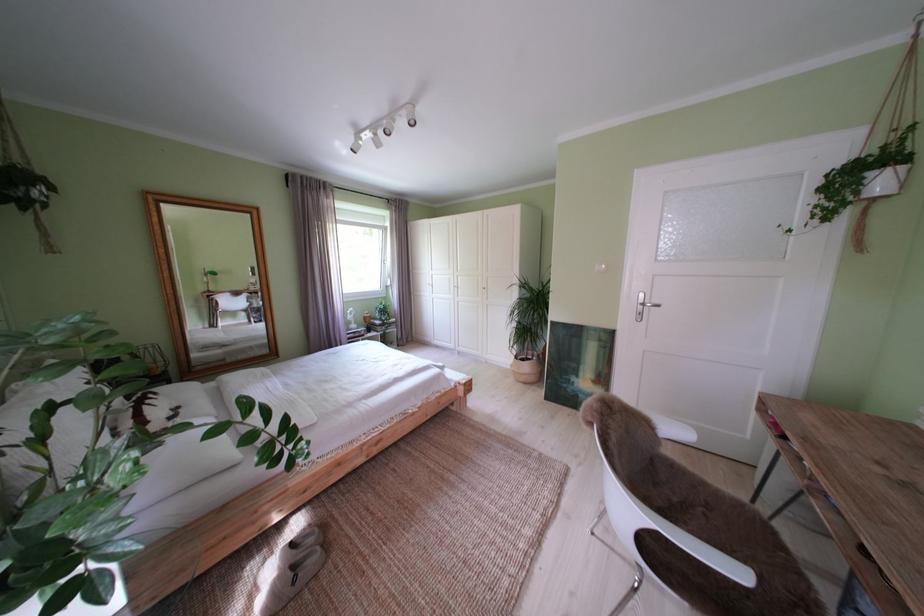
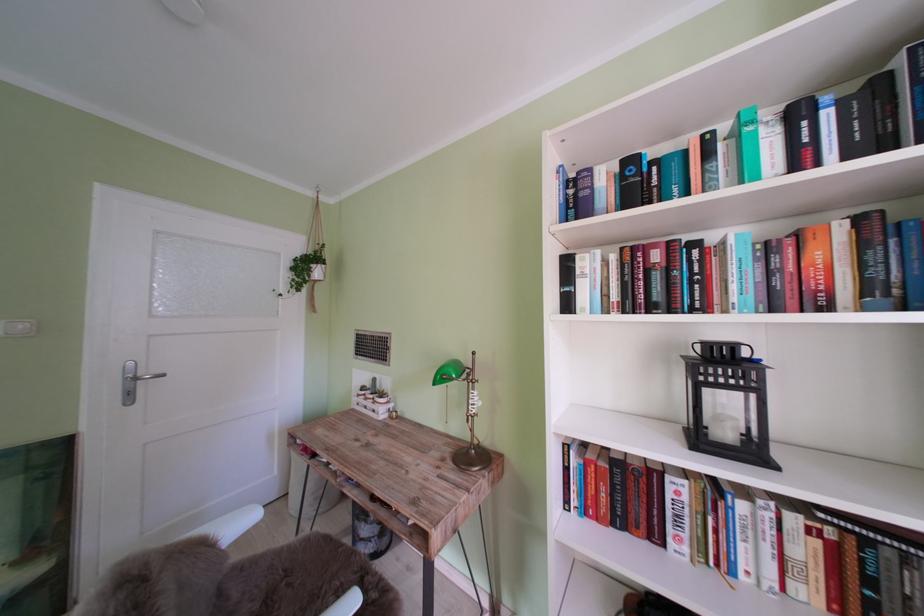
Question: The images are taken continuously from a first-person perspective. In which direction is your viewpoint rotating?

Choices:
 (A) Left
 (B) Right
 (C) Up
 (D) Down

Answer: (B)